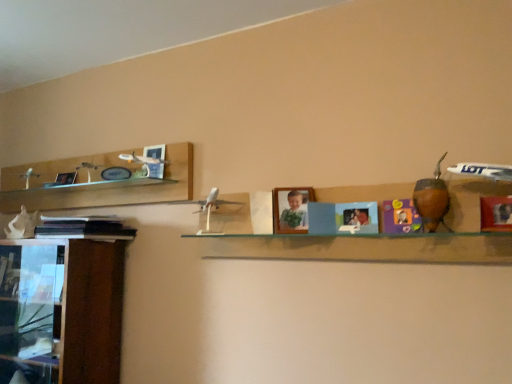
You are a GUI agent. You are given a task and a screenshot of the screen. Output one action in this format:
    pyautogui.click(x=<x>, y=<y>)
    Task: Click on the matte purple toy at center, which appears as the 2th toy when viewed from the front
    The image size is (512, 384).
    Given the screenshot: What is the action you would take?
    pyautogui.click(x=400, y=217)

Describe the element at coordinates (431, 199) in the screenshot. I see `brown leather gourd at right, placed as the first toy when sorted from front to back` at that location.

What do you see at coordinates (66, 306) in the screenshot?
I see `wooden cabinet at left` at bounding box center [66, 306].

The image size is (512, 384). Find the location of `matte purple toy at center, the 2th toy positioned from the left`. matte purple toy at center, the 2th toy positioned from the left is located at coordinates (400, 217).

In the image, there is a matte purple toy at center, which appears as the 2th toy when viewed from the front. Identify the location of shelf below it (from the image's perspective). This screenshot has width=512, height=384. (385, 238).

From a real-world perspective, who is located higher, matte purple toy at center, which is the second toy in back-to-front order, or clear glass shelf at center?

matte purple toy at center, which is the second toy in back-to-front order, from a real-world perspective.

Is matte purple toy at center, which appears as the 2th toy when viewed from the front, in contact with clear glass shelf at center?

Answer: No, matte purple toy at center, which appears as the 2th toy when viewed from the front, is not with clear glass shelf at center.

Is brown leather gourd at right, placed as the first toy when sorted from front to back, aimed at white matte seashell at left, the third toy viewed from the front?

No, brown leather gourd at right, placed as the first toy when sorted from front to back, is not turned towards white matte seashell at left, the third toy viewed from the front.

In the scene shown: How far apart are brown leather gourd at right, placed as the first toy when sorted from front to back, and white matte seashell at left, acting as the first toy starting from the left?

They are 1.70 meters apart.

From a real-world perspective, does brown leather gourd at right, placed as the first toy when sorted from front to back, sit lower than white matte seashell at left, the third toy viewed from the front?

No.

Is white matte seashell at left, marked as the first toy in a back-to-front arrangement, inside brown leather gourd at right, the first toy when ordered from right to left?

Actually, white matte seashell at left, marked as the first toy in a back-to-front arrangement, is outside brown leather gourd at right, the first toy when ordered from right to left.

Considering the sizes of white matte seashell at left, acting as the first toy starting from the left, and matte purple toy at center, the 2th toy viewed from the right, in the image, is white matte seashell at left, acting as the first toy starting from the left, wider or thinner than matte purple toy at center, the 2th toy viewed from the right,?

white matte seashell at left, acting as the first toy starting from the left, is wider than matte purple toy at center, the 2th toy viewed from the right.

Is white matte seashell at left, the third toy viewed from the front, not within matte purple toy at center, the 2th toy viewed from the right?

Absolutely, white matte seashell at left, the third toy viewed from the front, is external to matte purple toy at center, the 2th toy viewed from the right.

From the image's perspective, which is above, white matte seashell at left, the third toy viewed from the front, or matte purple toy at center, the 2th toy viewed from the right?

matte purple toy at center, the 2th toy viewed from the right, appears higher in the image.

From a real-world perspective, is white matte seashell at left, the third toy viewed from the front, physically located above or below matte purple toy at center, which is the second toy in back-to-front order?

white matte seashell at left, the third toy viewed from the front, is situated higher than matte purple toy at center, which is the second toy in back-to-front order, in the real world.

Is brown leather gourd at right, marked as the 3th toy in a left-to-right arrangement, at the back of clear glass shelf at center?

Yes, clear glass shelf at center's orientation is away from brown leather gourd at right, marked as the 3th toy in a left-to-right arrangement.

Does clear glass shelf at center have a lesser height compared to brown leather gourd at right, placed as the first toy when sorted from front to back?

Incorrect, the height of clear glass shelf at center does not fall short of that of brown leather gourd at right, placed as the first toy when sorted from front to back.

Between clear glass shelf at center and brown leather gourd at right, placed as the first toy when sorted from front to back, which one has larger width?

Wider between the two is clear glass shelf at center.

Which object is positioned more to the right, clear glass shelf at center or brown leather gourd at right, the first toy when ordered from right to left?

brown leather gourd at right, the first toy when ordered from right to left.

Consider the image. Is wooden cabinet at left touching brown leather gourd at right, marked as the 3th toy in a left-to-right arrangement?

No, wooden cabinet at left is not in contact with brown leather gourd at right, marked as the 3th toy in a left-to-right arrangement.

Looking at this image, what's the angular difference between wooden cabinet at left and brown leather gourd at right, placed as the first toy when sorted from front to back,'s facing directions?

wooden cabinet at left and brown leather gourd at right, placed as the first toy when sorted from front to back, are facing 1.03 degrees away from each other.

Does wooden cabinet at left have a lesser width compared to brown leather gourd at right, the first toy when ordered from right to left?

No.

Is wooden cabinet at left facing towards brown leather gourd at right, marked as the 3th toy in a left-to-right arrangement?

No, wooden cabinet at left does not turn towards brown leather gourd at right, marked as the 3th toy in a left-to-right arrangement.

From the image's perspective, is matte purple toy at center, the 2th toy viewed from the right, above or below wooden cabinet at left?

matte purple toy at center, the 2th toy viewed from the right, is above wooden cabinet at left.

Is matte purple toy at center, the 2th toy viewed from the right, situated inside wooden cabinet at left or outside?

matte purple toy at center, the 2th toy viewed from the right, is spatially situated outside wooden cabinet at left.

Is matte purple toy at center, which is the second toy in back-to-front order, facing towards wooden cabinet at left?

No, matte purple toy at center, which is the second toy in back-to-front order, is not oriented towards wooden cabinet at left.

Identify the location of cabinetry below the matte purple toy at center, which is the second toy in back-to-front order (from the image's perspective). (66, 306).

From a real-world perspective, is brown leather gourd at right, the first toy when ordered from right to left, positioned under wooden cabinet at left based on gravity?

No, from a real-world perspective, brown leather gourd at right, the first toy when ordered from right to left, is not under wooden cabinet at left.

From the image's perspective, which toy is the 3rd one above the wooden cabinet at left? Please provide its 2D coordinates.

[(431, 199)]

Which object is more forward, brown leather gourd at right, the first toy when ordered from right to left, or wooden cabinet at left?

brown leather gourd at right, the first toy when ordered from right to left, is in front.

Where is `the 1st toy positioned above the clear glass shelf at center (from the image's perspective)`? Image resolution: width=512 pixels, height=384 pixels. the 1st toy positioned above the clear glass shelf at center (from the image's perspective) is located at coordinates point(400,217).

From the image's perspective, which toy is the 2nd one below the brown leather gourd at right, the third toy viewed from the back? Please provide its 2D coordinates.

[(22, 225)]

Estimate the real-world distances between objects in this image. Which object is further from white matte seashell at left, marked as the first toy in a back-to-front arrangement, matte purple toy at center, the 2th toy positioned from the left, or wooden cabinet at left?

Based on the image, matte purple toy at center, the 2th toy positioned from the left, appears to be further to white matte seashell at left, marked as the first toy in a back-to-front arrangement.

When comparing their distances from matte purple toy at center, the 2th toy positioned from the left, does clear glass shelf at center or wooden cabinet at left seem further?

Among the two, wooden cabinet at left is located further to matte purple toy at center, the 2th toy positioned from the left.

Looking at the image, which one is located closer to black matte book at left, matte purple toy at center, the 2th toy positioned from the left, or clear glass shelf at center?

clear glass shelf at center is positioned closer to the anchor black matte book at left.

When comparing their distances from wooden cabinet at left, does black matte book at left or white matte seashell at left, acting as the first toy starting from the left, seem further?

The object further to wooden cabinet at left is white matte seashell at left, acting as the first toy starting from the left.

Based on the photo, from the image, which object appears to be farther from clear glass shelf at center, brown leather gourd at right, placed as the first toy when sorted from front to back, or matte purple toy at center, the 2th toy viewed from the right?

brown leather gourd at right, placed as the first toy when sorted from front to back, is positioned further to the anchor clear glass shelf at center.

Considering their positions, is wooden cabinet at left positioned further to black matte book at left than brown leather gourd at right, the first toy when ordered from right to left?

brown leather gourd at right, the first toy when ordered from right to left, lies further to black matte book at left than the other object.

Looking at the image, which one is located further to brown leather gourd at right, marked as the 3th toy in a left-to-right arrangement, clear glass shelf at center or matte purple toy at center, the 2th toy viewed from the right?

clear glass shelf at center is positioned further to the anchor brown leather gourd at right, marked as the 3th toy in a left-to-right arrangement.

Which object lies nearer to the anchor point brown leather gourd at right, placed as the first toy when sorted from front to back, black matte book at left or white matte seashell at left, which ranks as the 3th toy in right-to-left order?

black matte book at left is closer to brown leather gourd at right, placed as the first toy when sorted from front to back.

I want to click on cabinetry between white matte seashell at left, marked as the first toy in a back-to-front arrangement, and matte purple toy at center, which is the second toy in back-to-front order, from left to right, so click(x=66, y=306).

Where is `book between white matte seashell at left, marked as the first toy in a back-to-front arrangement, and matte purple toy at center, which is the second toy in back-to-front order`? This screenshot has width=512, height=384. book between white matte seashell at left, marked as the first toy in a back-to-front arrangement, and matte purple toy at center, which is the second toy in back-to-front order is located at coordinates tap(84, 228).

In order to click on toy situated between black matte book at left and brown leather gourd at right, marked as the 3th toy in a left-to-right arrangement, from left to right in this screenshot , I will do `click(400, 217)`.

The image size is (512, 384). I want to click on shelf between wooden cabinet at left and brown leather gourd at right, placed as the first toy when sorted from front to back, so click(x=385, y=238).